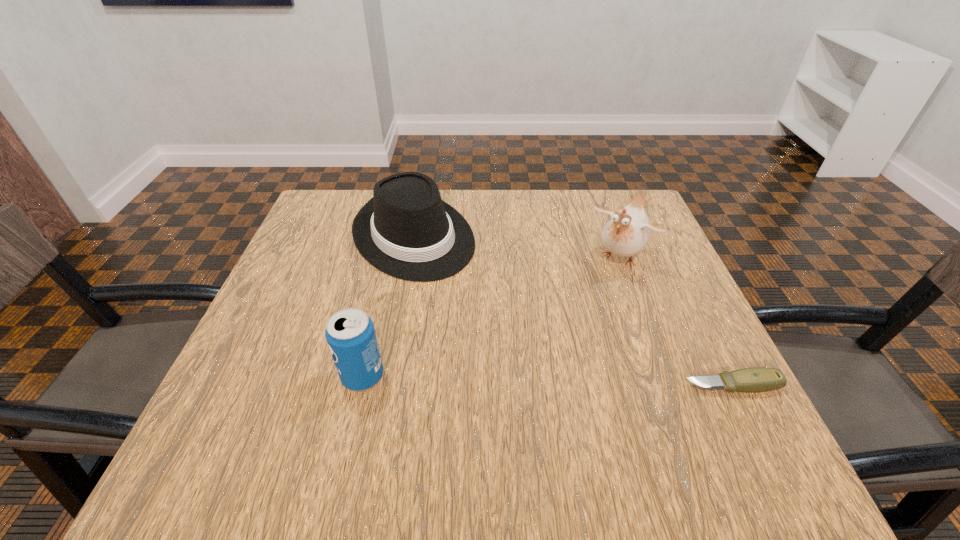
Image resolution: width=960 pixels, height=540 pixels. Identify the location of empty space that is in between the fedora and the bird. (517, 247).

Find the location of `vacant space in between the shortest object and the tallest object`. vacant space in between the shortest object and the tallest object is located at coordinates pyautogui.click(x=677, y=322).

You are a GUI agent. You are given a task and a screenshot of the screen. Output one action in this format:
    pyautogui.click(x=<x>, y=<y>)
    Task: Click on the vacant area that lies between the soda can and the tallest object
    The image size is (960, 540).
    Given the screenshot: What is the action you would take?
    pyautogui.click(x=492, y=317)

At what (x,y) coordinates should I click in order to perform the action: click on unoccupied position between the pocketknife and the fedora. Please return your answer as a coordinate pair (x, y). The height and width of the screenshot is (540, 960). Looking at the image, I should click on (573, 310).

I want to click on empty space that is in between the fedora and the soda can, so click(x=388, y=306).

Find the location of a particular element. vacant area that lies between the fedora and the soda can is located at coordinates (388, 306).

You are a GUI agent. You are given a task and a screenshot of the screen. Output one action in this format:
    pyautogui.click(x=<x>, y=<y>)
    Task: Click on the free space between the shortest object and the fedora
    This screenshot has width=960, height=540.
    Given the screenshot: What is the action you would take?
    pyautogui.click(x=573, y=310)

The image size is (960, 540). I want to click on empty space that is in between the fedora and the shortest object, so click(573, 310).

At what (x,y) coordinates should I click in order to perform the action: click on the second closest object to the shortest object. Please return your answer as a coordinate pair (x, y). Looking at the image, I should click on (406, 230).

The width and height of the screenshot is (960, 540). I want to click on the third closest object to the pocketknife, so click(350, 334).